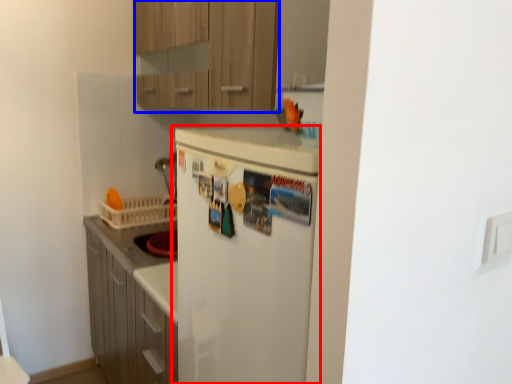
Question: Which object appears closest to the camera in this image, refrigerator (highlighted by a red box) or cabinetry (highlighted by a blue box)?

Choices:
 (A) refrigerator
 (B) cabinetry

Answer: (A)